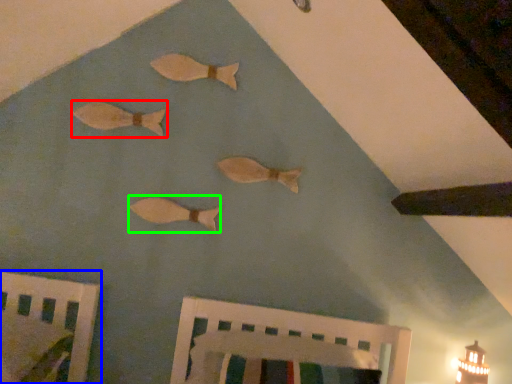
Question: Which object is the farthest from fish (highlighted by a red box)? Choose among these: furniture (highlighted by a blue box) or fish (highlighted by a green box).

Choices:
 (A) furniture
 (B) fish

Answer: (A)